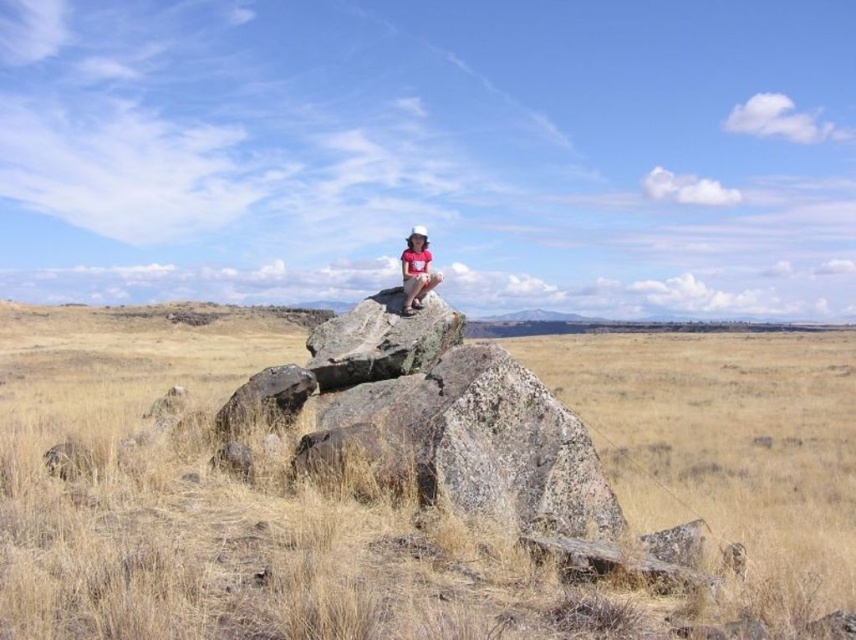
Based on the photo, you are standing at the base of the rock formation and want to place a 1.5 meter long hiking pole between the dry grass at center and the matte pink shirt at center. Can the pole fit between them without bending?

The distance between the dry grass at center and the matte pink shirt at center is 82.41 meters, so the 1.5 meter long hiking pole can easily fit between them without bending since the distance is much larger than the pole.

You are standing at the point with coordinates 0.5, 0.5 in this image. You want to walk to the dry grass at center. In which direction should you move? Please answer with either north, south, east, or west.

The dry grass at center is located at point (x=415, y=484). Since you are at (x=428, y=320), you should move east to reach it.

You are standing at the point marked by coordinates point (415, 484) in the image. Looking around, what do you see immediately around you?

The point (415, 484) indicates dry grass at center, so you are standing in the dry grass at center.